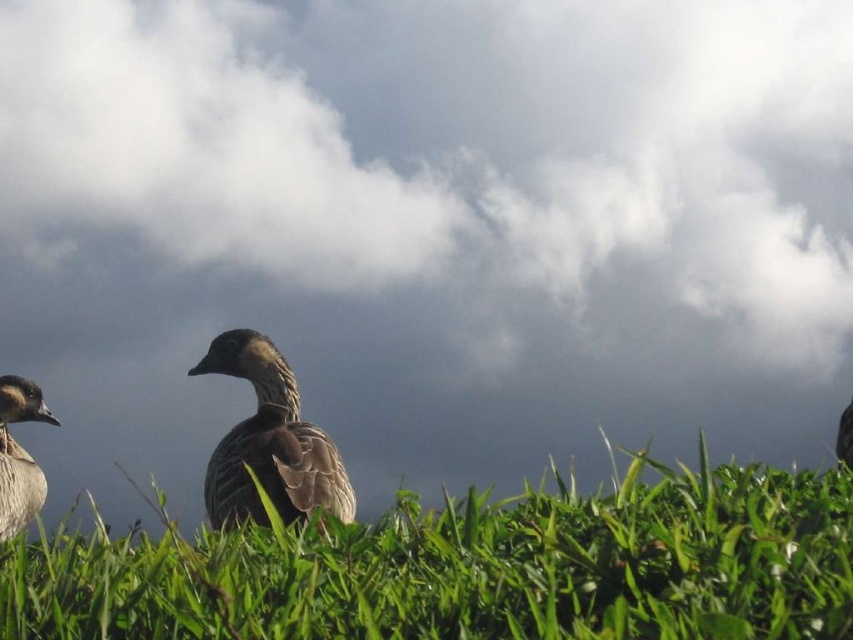
You are a photographer aiming to capture both the brown feathered duck at center and the brown feathered duck at left in a single frame. Based on their heights, which duck will appear smaller in the photo?

The brown feathered duck at center will appear smaller in the photo because it has a lesser height compared to the brown feathered duck at left.

Based on the photo, you are a photographer aiming to capture both the brown feathered duck at center and the brown feathered duck at left in a single shot. Based on their positions, which duck is closer to the camera?

The brown feathered duck at center is closer to the camera because it is positioned in front of the brown feathered duck at left.

You are a photographer standing in a field and want to capture a closeup of the green grassy area at center. If your camera can focus clearly on objects within 2 meters, will the green grassy at center be in focus?

The green grassy at center is 2.27 meters away from the viewer. Since the camera can focus within 2 meters, the green grassy at center will be out of focus.